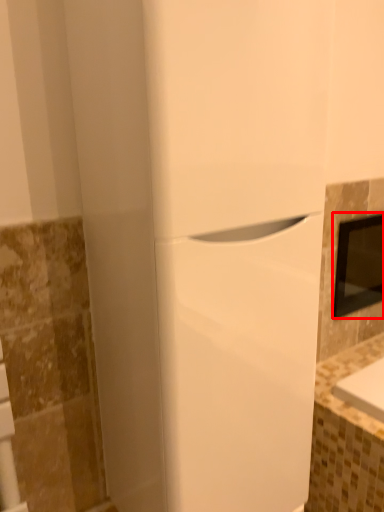
Question: From the image's perspective, where is medicine cabinet (annotated by the red box) located relative to home appliance?

Choices:
 (A) below
 (B) above

Answer: (B)